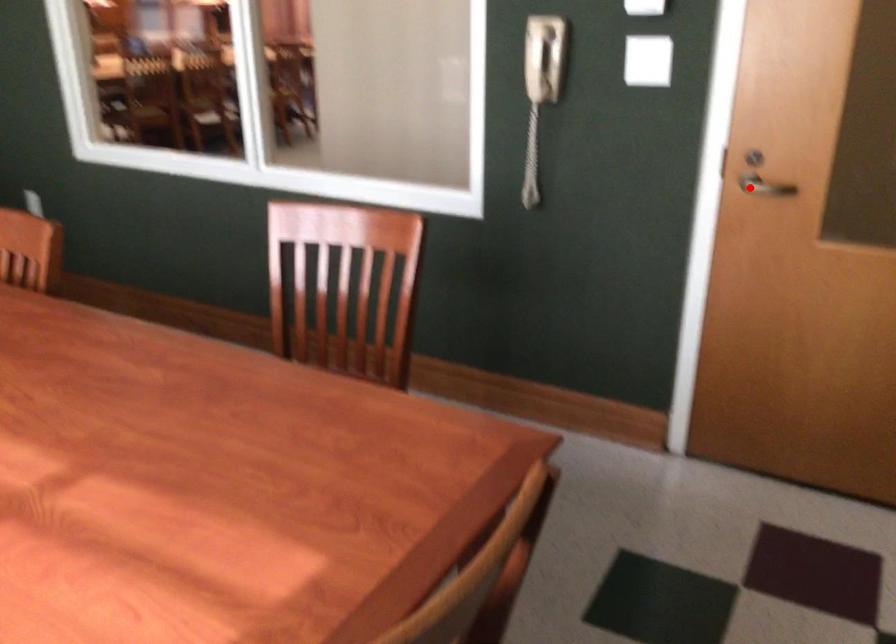
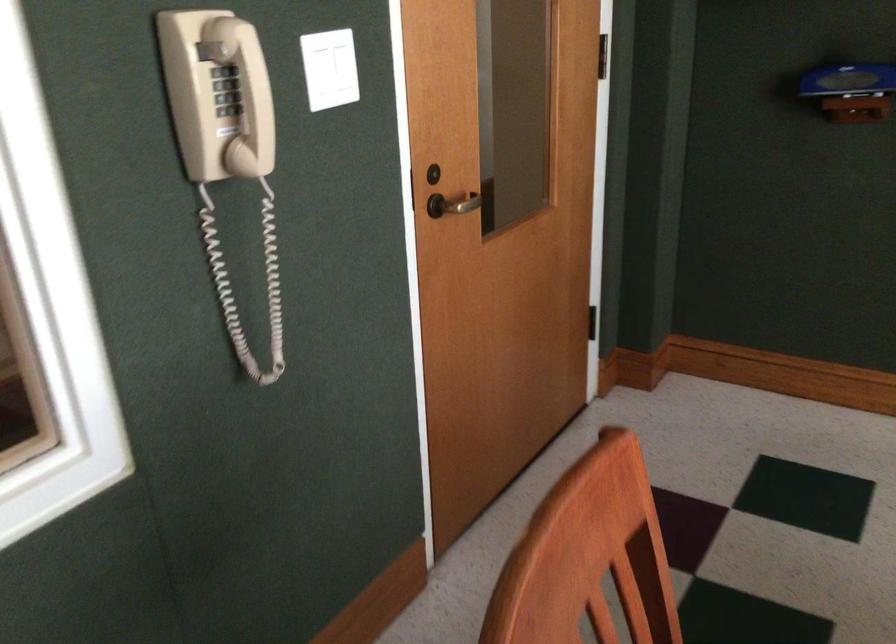
Question: A red point is marked in image1. In image2, is the corresponding 3D point closer to the camera or farther? Reply with the corresponding letter.

Choices:
 (A) The corresponding 3D point is closer.
 (B) The corresponding 3D point is farther.

Answer: (A)